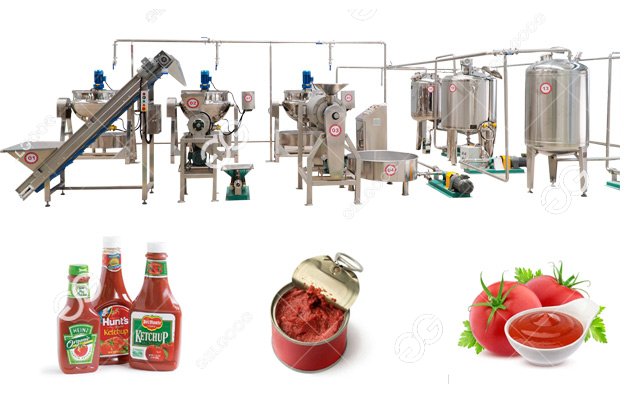
The height and width of the screenshot is (400, 630). I want to click on sharp edges of a metal lid, so click(351, 307), click(356, 277), click(305, 261), click(284, 297), click(289, 335), click(335, 333).